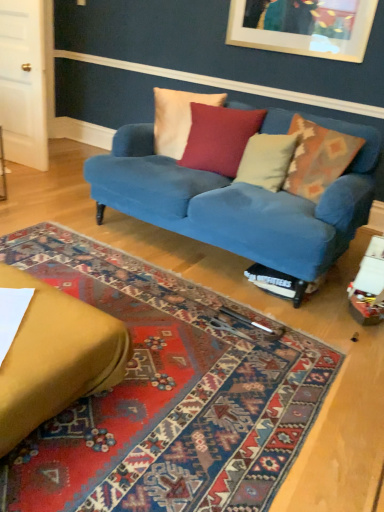
The width and height of the screenshot is (384, 512). I want to click on free space above carpeted rug at center (from a real-world perspective), so click(x=133, y=324).